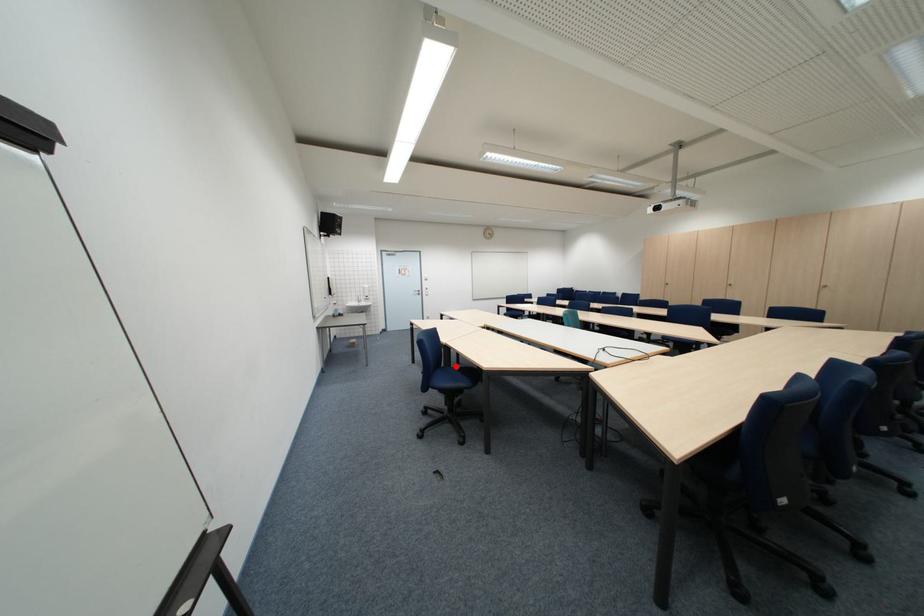
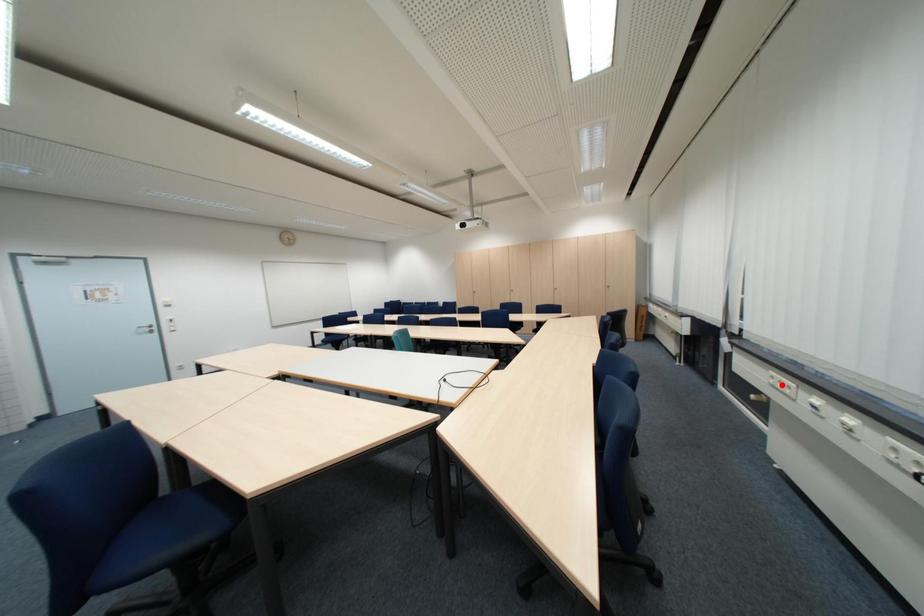
I am providing you with two images of the same scene from different viewpoints. A red point is marked on the first image and another point is marked on the second image. Is the red point in image1 aligned with the point shown in image2?

No